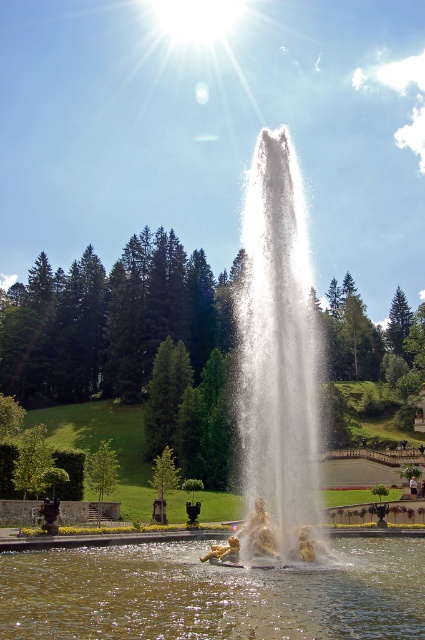
You are standing at the edge of the fountain and want to know which part of the water is higher. Based on the scene, can you tell me whether the clear water at fountain center is higher or lower than the white water at center?

The clear water at fountain center is shorter than the white water at center, so the clear water at fountain center is lower than the white water at center.

You are a landscape architect designing a new garden. You have to place a small statue that requires a water surface area of at least 2 square meters. Given the clear water at fountain center and white water at center, which one would be suitable for placing the statue?

The white water at center has a larger surface area than the clear water at fountain center, so the statue should be placed on the white water at center to meet the requirement.

You are standing in the formal garden and see the fountain. Which object is positioned to the left of the other between the clear water at fountain center and the white water at center?

The clear water at fountain center is to the left of the white water at center.